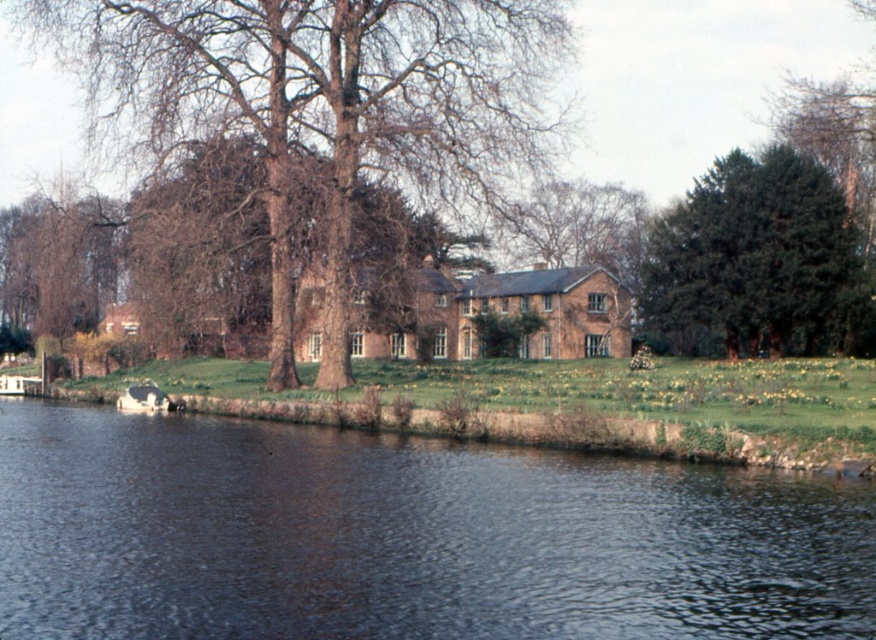
Question: Among these points, which one is farthest from the camera?

Choices:
 (A) (825, 170)
 (B) (61, 224)
 (C) (136, 470)
 (D) (379, 109)

Answer: (B)

Question: Can you confirm if dark blue water at lower left is positioned below bare branches at center?

Choices:
 (A) yes
 (B) no

Answer: (A)

Question: Among these points, which one is farthest from the camera?

Choices:
 (A) (422, 488)
 (B) (8, 330)

Answer: (B)

Question: Which point appears closest to the camera in this image?

Choices:
 (A) 524,140
 (B) 823,337

Answer: (A)

Question: Considering the relative positions of dark blue water at lower left and brown textured tree at center in the image provided, where is dark blue water at lower left located with respect to brown textured tree at center?

Choices:
 (A) below
 (B) above

Answer: (A)

Question: Considering the relative positions of dark green evergreen tree at upper right and bare wood tree at left in the image provided, where is dark green evergreen tree at upper right located with respect to bare wood tree at left?

Choices:
 (A) left
 (B) right

Answer: (B)